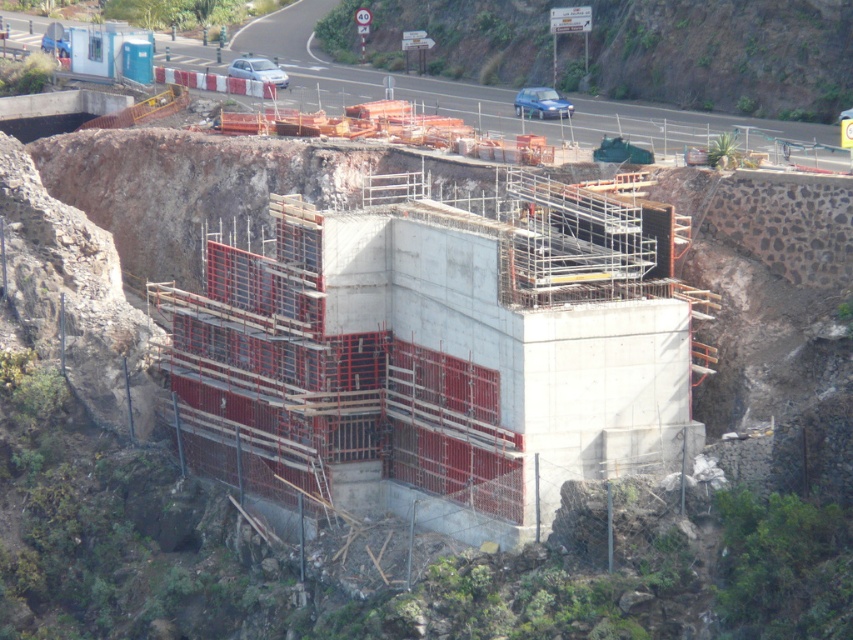
Who is shorter, concrete at center or green mossy rock at upper center?

green mossy rock at upper center

Between concrete at center and green mossy rock at upper center, which one appears on the right side from the viewer's perspective?

Positioned to the right is green mossy rock at upper center.

Who is more forward, (838, 13) or (618, 93)?

Point (838, 13)

Identify the location of concrete at center. This screenshot has width=853, height=640. (727, 56).